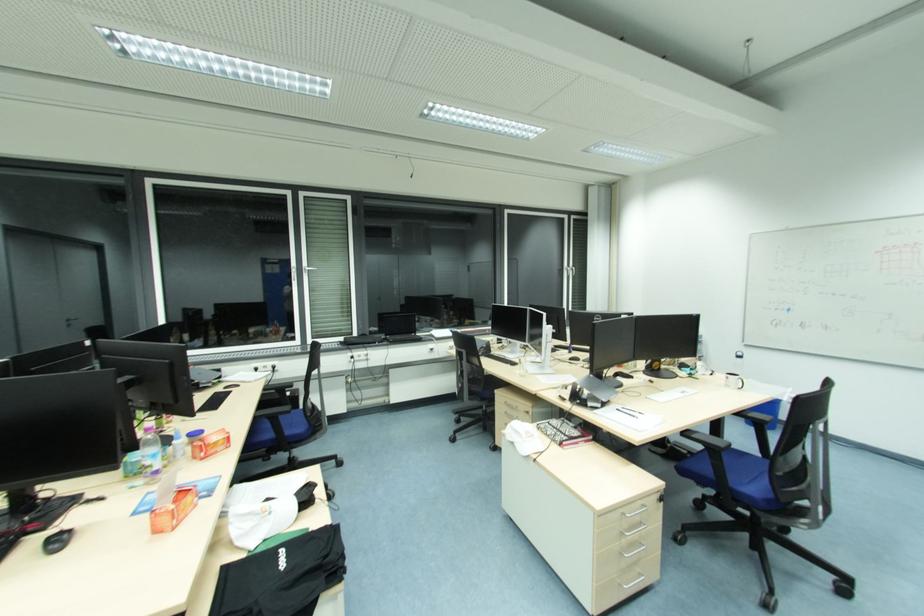
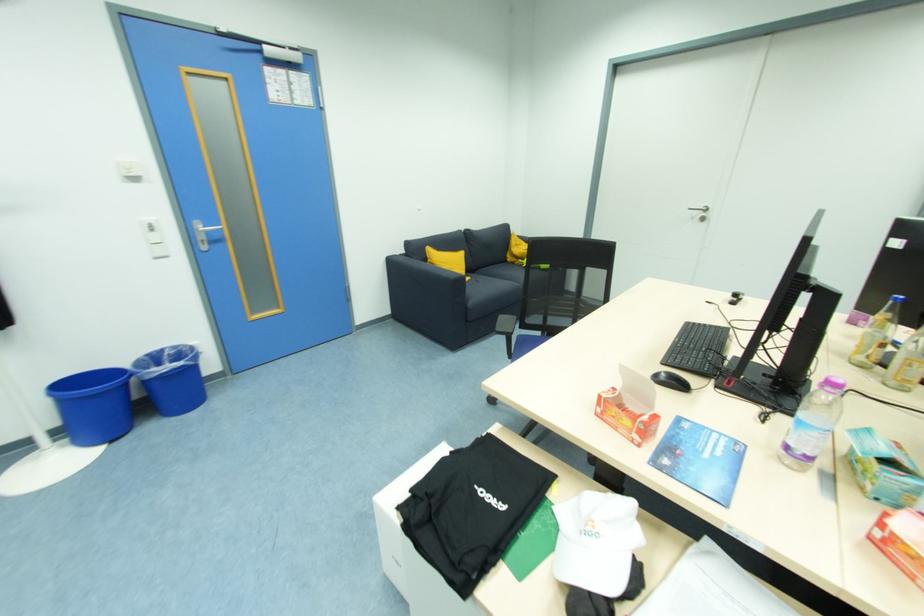
Find the pixel in the second image that matches pixel 159 474 in the first image.

(792, 448)